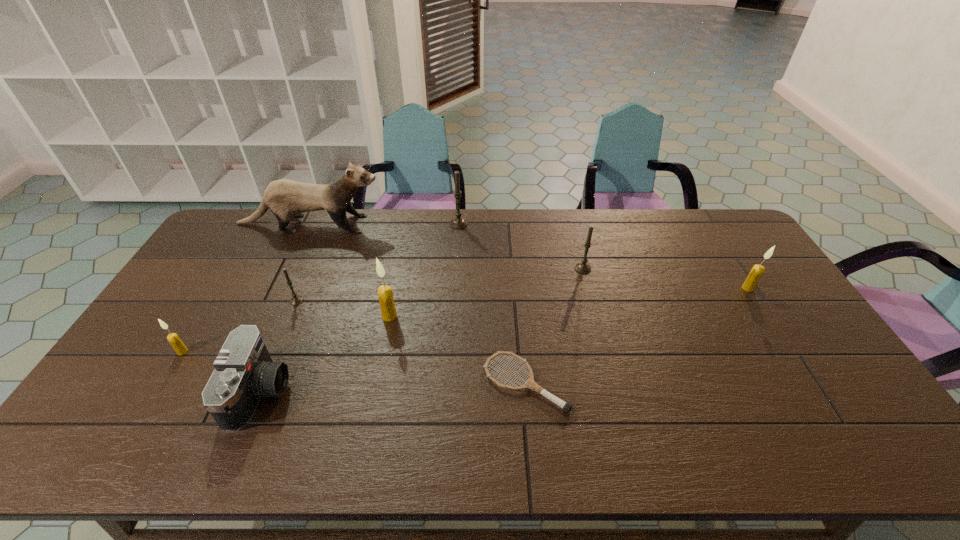
Where is `vacant area that lies between the fifth candle from left to right and the camera`? vacant area that lies between the fifth candle from left to right and the camera is located at coordinates (421, 330).

Where is `free space between the second candle from left to right and the camera`? free space between the second candle from left to right and the camera is located at coordinates (278, 346).

What are the coordinates of `unoccupied position between the biggest gray candle and the third object from right to left` in the screenshot? It's located at (492, 303).

Find the location of `object that stands as the sixth closest to the second candle from right to left`. object that stands as the sixth closest to the second candle from right to left is located at coordinates (296, 299).

Identify which object is the eighth nearest to the black camera. Please provide its 2D coordinates. Your answer should be formatted as a tuple, i.e. [(x, y)], where the tuple contains the x and y coordinates of a point satisfying the conditions above.

[(756, 272)]

Where is `candle that is the fifth closest to the nearest candle`? The image size is (960, 540). candle that is the fifth closest to the nearest candle is located at coordinates (756, 272).

Locate which candle ranks fifth in proximity to the farthest gray candle. Please provide its 2D coordinates. Your answer should be formatted as a tuple, i.e. [(x, y)], where the tuple contains the x and y coordinates of a point satisfying the conditions above.

[(756, 272)]

The height and width of the screenshot is (540, 960). In order to click on gray candle object that ranks as the closest to the third candle from left to right in this screenshot , I will do `click(296, 299)`.

Choose which gray candle is the third nearest neighbor to the black camera. Please provide its 2D coordinates. Your answer should be formatted as a tuple, i.e. [(x, y)], where the tuple contains the x and y coordinates of a point satisfying the conditions above.

[(583, 268)]

This screenshot has width=960, height=540. I want to click on the third closest cream candle to the gray ferret, so click(x=756, y=272).